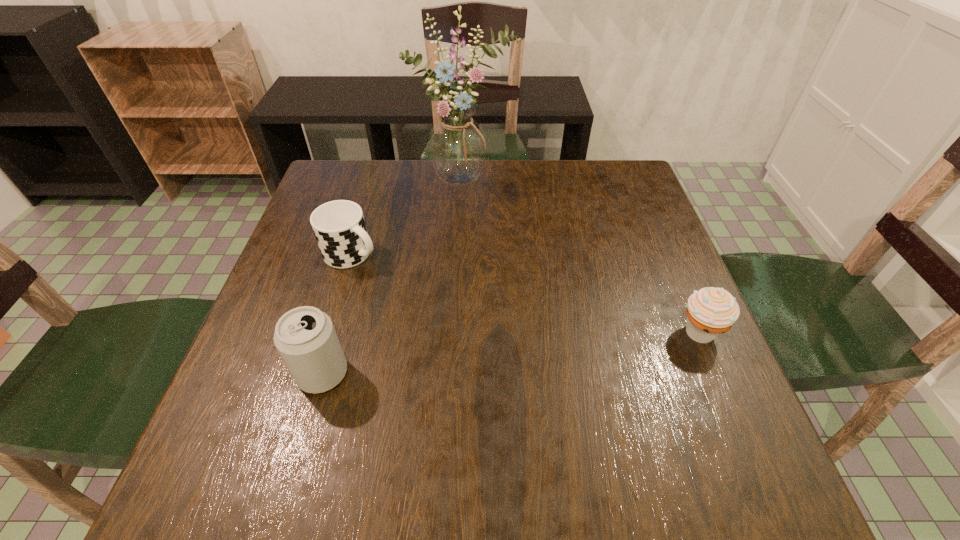
At what (x,y) coordinates should I click in order to perform the action: click on vacant region located 0.200m on the side of the second farthest object with the handle. Please return your answer as a coordinate pair (x, y). The image size is (960, 540). Looking at the image, I should click on (441, 300).

What are the coordinates of `vacant space located 0.330m on the side of the second farthest object with the handle` in the screenshot? It's located at (491, 328).

The height and width of the screenshot is (540, 960). I want to click on free space located on the front-facing side of the farthest object, so click(x=530, y=275).

Identify the location of free space located on the front-facing side of the farthest object. (519, 258).

Where is `vacant space located 0.170m on the front-facing side of the farthest object`? The height and width of the screenshot is (540, 960). vacant space located 0.170m on the front-facing side of the farthest object is located at coordinates (505, 235).

Where is `object located at the far edge`? The height and width of the screenshot is (540, 960). object located at the far edge is located at coordinates (457, 145).

Locate an element on the screen. The image size is (960, 540). object present at the near edge is located at coordinates (305, 337).

Locate an element on the screen. Image resolution: width=960 pixels, height=540 pixels. can present at the left edge is located at coordinates (305, 337).

You are a GUI agent. You are given a task and a screenshot of the screen. Output one action in this format:
    pyautogui.click(x=<x>, y=<y>)
    Task: Click on the cup located in the left edge section of the desktop
    
    Given the screenshot: What is the action you would take?
    pyautogui.click(x=339, y=227)

This screenshot has height=540, width=960. In order to click on object at the right edge in this screenshot , I will do `click(711, 311)`.